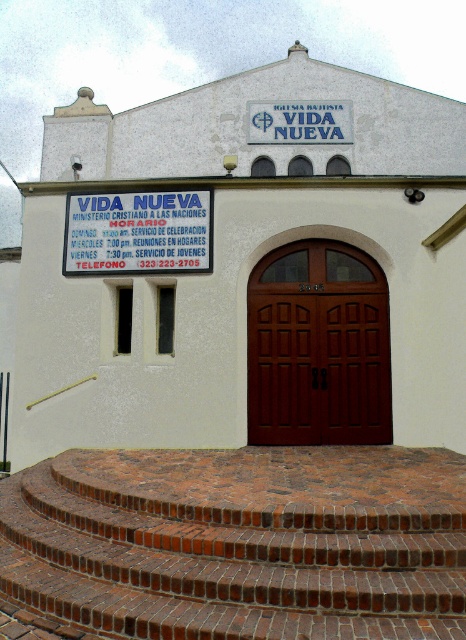
Question: Which of the following is the closest to the observer?

Choices:
 (A) white plastic sign at center
 (B) mahogany wood door at center
 (C) white plastic sign at upper center
 (D) brick stairs at center

Answer: (D)

Question: Can you confirm if brick stairs at center is thinner than white plastic sign at upper center?

Choices:
 (A) no
 (B) yes

Answer: (A)

Question: Which of these objects is positioned closest to the white plastic sign at center?

Choices:
 (A) mahogany wood door at center
 (B) white matte building at center
 (C) white plastic sign at upper center
 (D) brick stairs at center

Answer: (A)

Question: Can you confirm if mahogany wood door at center is positioned to the right of white plastic sign at upper center?

Choices:
 (A) no
 (B) yes

Answer: (A)

Question: Which point is closer to the camera?

Choices:
 (A) brick stairs at center
 (B) mahogany wood door at center
 (C) white plastic sign at upper center

Answer: (A)

Question: Is mahogany wood door at center wider than white plastic sign at center?

Choices:
 (A) yes
 (B) no

Answer: (B)